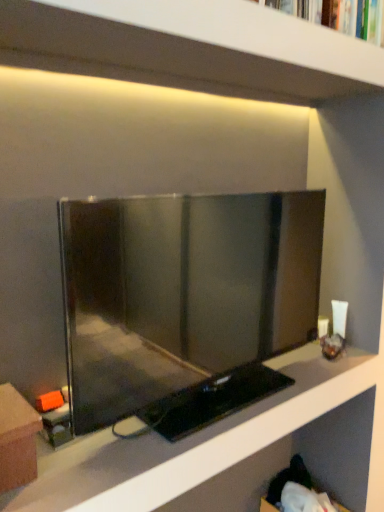
Question: From the image's perspective, is white matte shelf at upper center, the first shelf in the top-to-bottom sequence, on matte black tv at center, arranged as the 1th shelf when ordered from the bottom?

Choices:
 (A) no
 (B) yes

Answer: (B)

Question: Considering the relative sizes of white matte shelf at upper center, which ranks as the 2th shelf in bottom-to-top order, and matte black tv at center, arranged as the 1th shelf when ordered from the bottom, in the image provided, is white matte shelf at upper center, which ranks as the 2th shelf in bottom-to-top order, shorter than matte black tv at center, arranged as the 1th shelf when ordered from the bottom,?

Choices:
 (A) yes
 (B) no

Answer: (B)

Question: Is white matte shelf at upper center, the first shelf in the top-to-bottom sequence, next to matte black tv at center, arranged as the 1th shelf when ordered from the bottom?

Choices:
 (A) yes
 (B) no

Answer: (B)

Question: Is the depth of white matte shelf at upper center, the first shelf in the top-to-bottom sequence, greater than that of matte black tv at center, which is the 2th shelf in top-to-bottom order?

Choices:
 (A) no
 (B) yes

Answer: (A)

Question: Is white matte shelf at upper center, which ranks as the 2th shelf in bottom-to-top order, aimed at matte black tv at center, which is the 2th shelf in top-to-bottom order?

Choices:
 (A) no
 (B) yes

Answer: (A)

Question: Relative to hardcover book at upper center, is brown cardboard box at lower left in front or behind?

Choices:
 (A) front
 (B) behind

Answer: (A)

Question: Visually, is brown cardboard box at lower left positioned to the left or to the right of hardcover book at upper center?

Choices:
 (A) right
 (B) left

Answer: (B)

Question: From a real-world perspective, is brown cardboard box at lower left positioned above or below hardcover book at upper center?

Choices:
 (A) above
 (B) below

Answer: (B)

Question: Is brown cardboard box at lower left wider or thinner than hardcover book at upper center?

Choices:
 (A) wide
 (B) thin

Answer: (A)

Question: Is point [x=87, y=369] closer or farther from the camera than point [x=372, y=30]?

Choices:
 (A) farther
 (B) closer

Answer: (B)

Question: Which is correct: matte black tv at center is inside hardcover book at upper center, or outside of it?

Choices:
 (A) inside
 (B) outside

Answer: (B)

Question: Is matte black tv at center in front of or behind hardcover book at upper center in the image?

Choices:
 (A) front
 (B) behind

Answer: (A)

Question: Is matte black tv at center bigger or smaller than hardcover book at upper center?

Choices:
 (A) big
 (B) small

Answer: (A)

Question: In terms of width, does matte black tv at center look wider or thinner when compared to matte black tv at center, arranged as the 1th shelf when ordered from the bottom?

Choices:
 (A) thin
 (B) wide

Answer: (A)

Question: Is point (107, 221) positioned closer to the camera than point (148, 464)?

Choices:
 (A) farther
 (B) closer

Answer: (B)